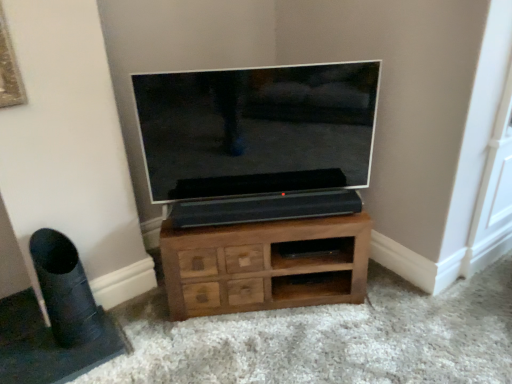
The height and width of the screenshot is (384, 512). In order to click on free space to the right of brown wood chest of drawers at center in this screenshot , I will do `click(413, 320)`.